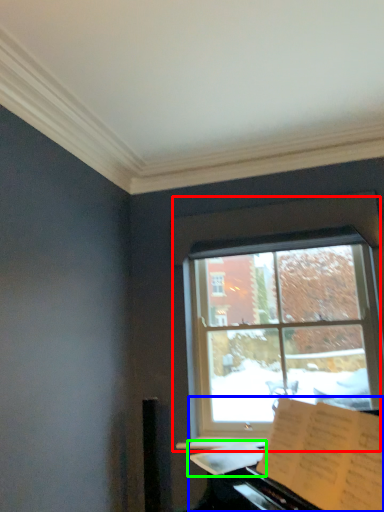
Question: Based on their relative distances, which object is nearer to window (highlighted by a red box)? Choose from piano (highlighted by a blue box) and sheet music (highlighted by a green box).

Choices:
 (A) piano
 (B) sheet music

Answer: (B)